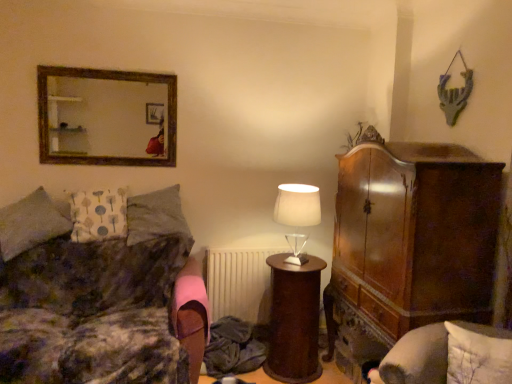
Find the location of a particular element. free location above wooden frame mirror at upper left (from a real-world perspective) is located at coordinates (106, 67).